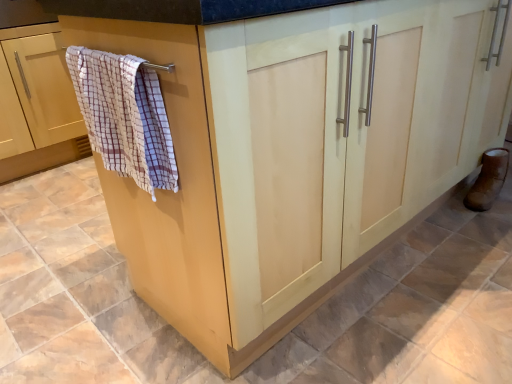
Locate an element on the screen. This screenshot has height=384, width=512. empty space that is ontop of brown leather boot at lower right is located at coordinates tap(494, 158).